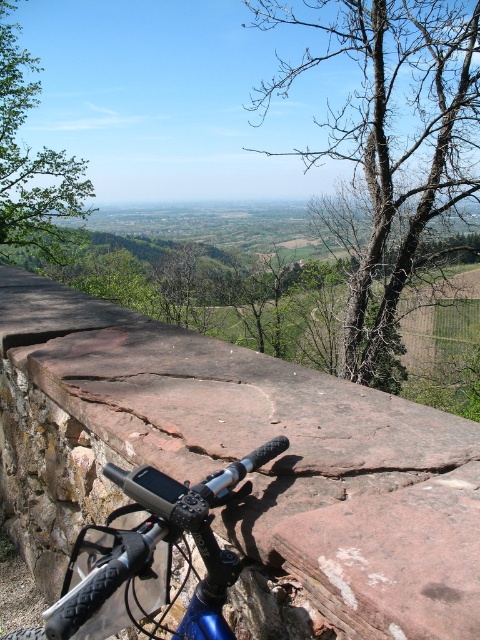
Is reddish-brown stone at center below bare wood tree at upper right?

Yes.

Can you confirm if reddish-brown stone at center is taller than bare wood tree at upper right?

Incorrect, reddish-brown stone at center's height is not larger of bare wood tree at upper right's.

Who is more forward, (454, 618) or (468, 195)?

Positioned in front is point (454, 618).

At what (x,y) coordinates should I click in order to perform the action: click on reddish-brown stone at center. Please return your answer as a coordinate pair (x, y). Looking at the image, I should click on (227, 472).

Does blue metallic bicycle handlebar at center have a smaller size compared to green leafy tree at upper left?

Actually, blue metallic bicycle handlebar at center might be larger than green leafy tree at upper left.

Image resolution: width=480 pixels, height=640 pixels. What are the coordinates of `blue metallic bicycle handlebar at center` in the screenshot? It's located at (151, 556).

Find the location of a particular element. The image size is (480, 640). blue metallic bicycle handlebar at center is located at coordinates (151, 556).

Find the location of `blue metallic bicycle handlebar at center`. blue metallic bicycle handlebar at center is located at coordinates (151, 556).

How far apart are reddish-brown stone at center and blue metallic bicycle handlebar at center?

→ 29.52 inches

At what (x,y) coordinates should I click in order to perform the action: click on reddish-brown stone at center. Please return your answer as a coordinate pair (x, y). Looking at the image, I should click on (227, 472).

Identify the location of reddish-brown stone at center. The height and width of the screenshot is (640, 480). (227, 472).